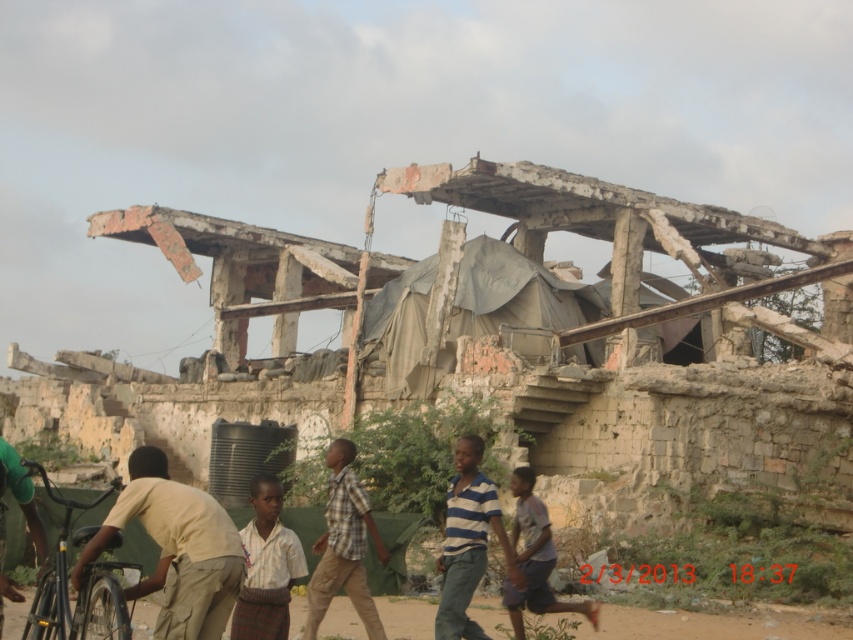
You are observing a group of people walking near a damaged building. You see a light beige fabric shirt at lower left and a plaid shirt at center. Which person is shorter?

The light beige fabric shirt at lower left is shorter than the plaid shirt at center.

You are a photographer trying to capture a group photo of the light beige fabric shirt at lower left and the plaid shirt at center. What is the minimum distance you need to maintain between the two subjects to ensure both are in frame?

The light beige fabric shirt at lower left and plaid shirt at center are 32.84 feet apart, so the photographer must maintain at least 32.84 feet between them to ensure both are in frame.

You are standing in front of the dilapidated building and notice two points marked on the structure. The first point is at coordinate point [163,611] and the second at point [343,460]. Which of these two points is physically closer to your current position?

Point [163,611] is closer to the viewer than point [343,460], so the first point is closer to your current position.